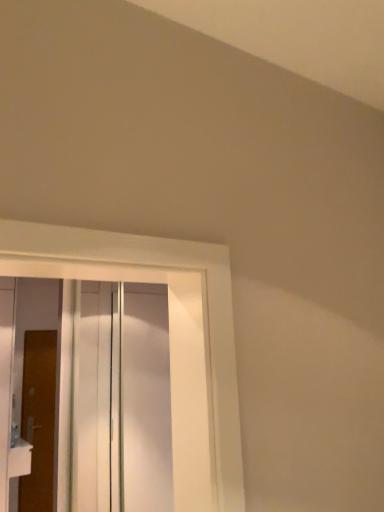
Question: Does white glossy door at left, the 1th door when ordered from front to back, contain transparent glass door at center?

Choices:
 (A) no
 (B) yes

Answer: (A)

Question: Are white glossy door at left, the 1th door when ordered from front to back, and transparent glass door at center making contact?

Choices:
 (A) no
 (B) yes

Answer: (A)

Question: Is the depth of white glossy door at left, the 1th door when ordered from front to back, less than that of transparent glass door at center?

Choices:
 (A) no
 (B) yes

Answer: (A)

Question: Can you confirm if white glossy door at left, the 1th door when ordered from front to back, is shorter than transparent glass door at center?

Choices:
 (A) yes
 (B) no

Answer: (B)

Question: From a real-world perspective, is white glossy door at left, placed as the second door when sorted from back to front, under transparent glass door at center?

Choices:
 (A) yes
 (B) no

Answer: (A)

Question: Is white plastic sink at lower left in front of or behind white glossy door at left, the 1th door when ordered from front to back, in the image?

Choices:
 (A) front
 (B) behind

Answer: (B)

Question: Considering the positions of white plastic sink at lower left and white glossy door at left, the 1th door when ordered from front to back, in the image, is white plastic sink at lower left taller or shorter than white glossy door at left, the 1th door when ordered from front to back,?

Choices:
 (A) short
 (B) tall

Answer: (A)

Question: Looking at their shapes, would you say white plastic sink at lower left is wider or thinner than white glossy door at left, the 1th door when ordered from front to back?

Choices:
 (A) wide
 (B) thin

Answer: (A)

Question: Considering the positions of point (13, 463) and point (3, 459), is point (13, 463) closer or farther from the camera than point (3, 459)?

Choices:
 (A) closer
 (B) farther

Answer: (B)

Question: Is brown wooden door at left, arranged as the second door when viewed from the front, in front of or behind transparent glass door at center in the image?

Choices:
 (A) front
 (B) behind

Answer: (B)

Question: From the image's perspective, is brown wooden door at left, arranged as the second door when viewed from the front, located above or below transparent glass door at center?

Choices:
 (A) below
 (B) above

Answer: (A)

Question: Based on their positions, is brown wooden door at left, arranged as the second door when viewed from the front, located to the left or right of transparent glass door at center?

Choices:
 (A) left
 (B) right

Answer: (A)

Question: From a real-world perspective, is brown wooden door at left, arranged as the second door when viewed from the front, above or below transparent glass door at center?

Choices:
 (A) below
 (B) above

Answer: (A)

Question: Considering the positions of white glossy door at left, placed as the second door when sorted from back to front, and white plastic sink at lower left in the image, is white glossy door at left, placed as the second door when sorted from back to front, wider or thinner than white plastic sink at lower left?

Choices:
 (A) wide
 (B) thin

Answer: (B)

Question: Is white glossy door at left, placed as the second door when sorted from back to front, spatially inside white plastic sink at lower left, or outside of it?

Choices:
 (A) outside
 (B) inside

Answer: (A)